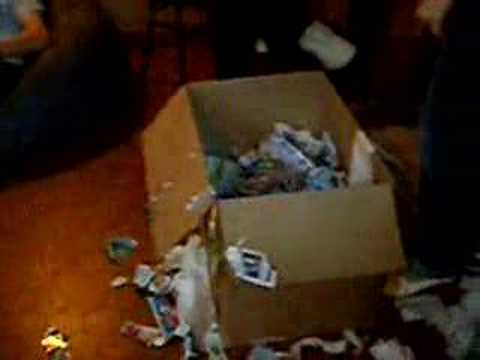
Find the location of a particular element. Image resolution: width=480 pixels, height=360 pixels. inside box walls is located at coordinates (270, 103), (332, 129).